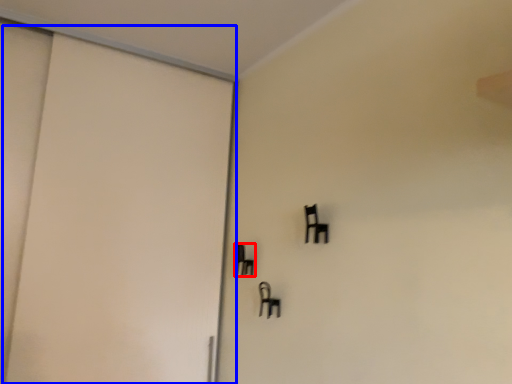
Question: Which of the following is the closest to the observer, furniture (highlighted by a red box) or door (highlighted by a blue box)?

Choices:
 (A) furniture
 (B) door

Answer: (B)